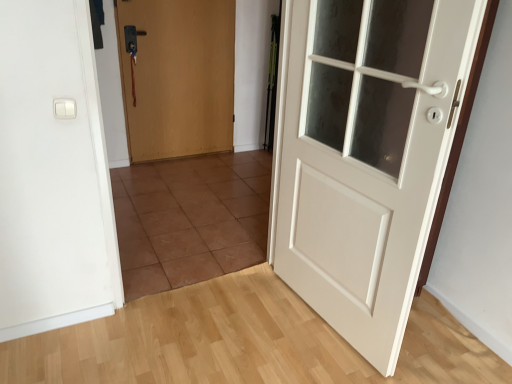
Question: Is white plastic light switch at upper left placed right next to wooden door at center, the first door viewed from the left?

Choices:
 (A) no
 (B) yes

Answer: (A)

Question: From a real-world perspective, does white plastic light switch at upper left sit lower than wooden door at center, the second door from the front?

Choices:
 (A) yes
 (B) no

Answer: (B)

Question: Does white plastic light switch at upper left come in front of wooden door at center, the first door viewed from the left?

Choices:
 (A) no
 (B) yes

Answer: (B)

Question: Can you confirm if white plastic light switch at upper left is positioned to the left of wooden door at center, the first door viewed from the left?

Choices:
 (A) yes
 (B) no

Answer: (A)

Question: Considering the relative sizes of white plastic light switch at upper left and wooden door at center, the first door viewed from the left, in the image provided, is white plastic light switch at upper left wider than wooden door at center, the first door viewed from the left,?

Choices:
 (A) yes
 (B) no

Answer: (B)

Question: Is white matte door at right, arranged as the second door when viewed from the back, wider or thinner than wooden door at center, positioned as the 1th door in back-to-front order?

Choices:
 (A) thin
 (B) wide

Answer: (B)

Question: Choose the correct answer: Is white matte door at right, the 2th door when ordered from left to right, inside wooden door at center, the 2th door positioned from the right, or outside it?

Choices:
 (A) inside
 (B) outside

Answer: (B)

Question: Based on their positions, is white matte door at right, arranged as the second door when viewed from the back, located to the left or right of wooden door at center, the second door from the front?

Choices:
 (A) right
 (B) left

Answer: (A)

Question: From a real-world perspective, is white matte door at right, which ranks as the 1th door in front-to-back order, positioned above or below wooden door at center, the second door from the front?

Choices:
 (A) above
 (B) below

Answer: (A)

Question: Is white plastic light switch at upper left to the left or to the right of white matte door at right, which ranks as the 1th door in front-to-back order, in the image?

Choices:
 (A) left
 (B) right

Answer: (A)

Question: From the image's perspective, is white plastic light switch at upper left positioned above or below white matte door at right, which ranks as the 1th door in front-to-back order?

Choices:
 (A) below
 (B) above

Answer: (B)

Question: Do you think white plastic light switch at upper left is within white matte door at right, the 2th door when ordered from left to right, or outside of it?

Choices:
 (A) inside
 (B) outside

Answer: (B)

Question: Considering their positions, is white plastic light switch at upper left located in front of or behind white matte door at right, the 2th door when ordered from left to right?

Choices:
 (A) front
 (B) behind

Answer: (B)

Question: Based on their sizes in the image, would you say brown tile at center is bigger or smaller than white matte door at right, which ranks as the 1th door in front-to-back order?

Choices:
 (A) big
 (B) small

Answer: (A)

Question: Considering the positions of brown tile at center and white matte door at right, the 2th door when ordered from left to right, in the image, is brown tile at center wider or thinner than white matte door at right, the 2th door when ordered from left to right,?

Choices:
 (A) thin
 (B) wide

Answer: (B)